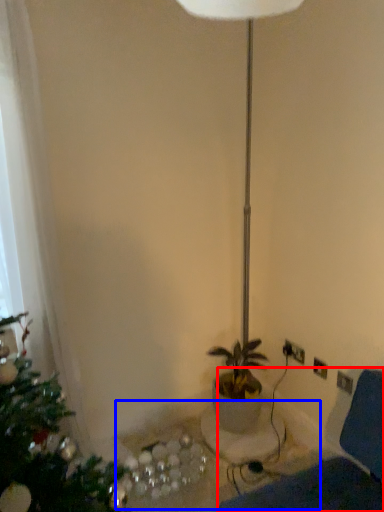
Question: Which object is further to the camera taking this photo, swivel chair (highlighted by a red box) or table (highlighted by a blue box)?

Choices:
 (A) swivel chair
 (B) table

Answer: (B)